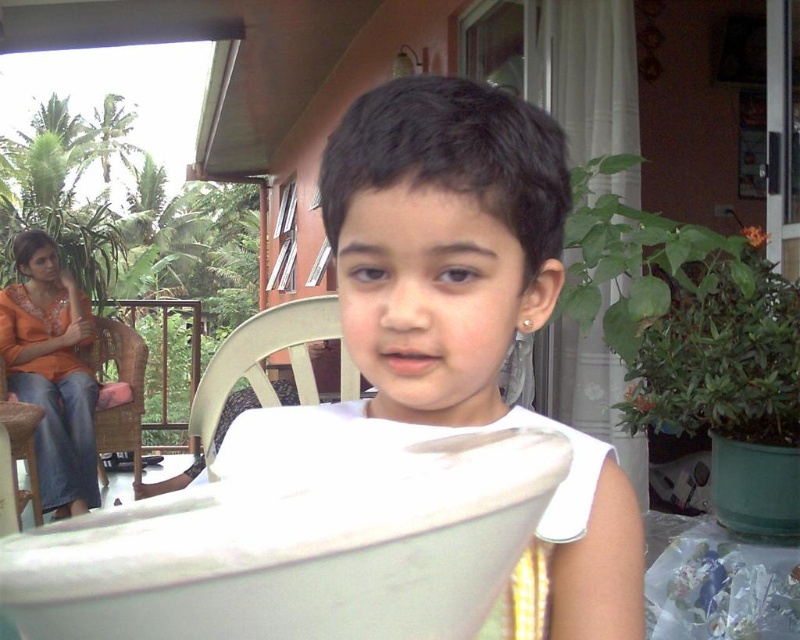
Question: Which object is farther from the camera taking this photo?

Choices:
 (A) wooden chair at center
 (B) white matte paper at center
 (C) transparent plastic bag at lower right
 (D) rattan chair at left

Answer: (D)

Question: Which point is farther to the camera?

Choices:
 (A) (713, 586)
 (B) (462, 180)
 (C) (345, 355)
 (D) (121, 362)

Answer: (D)

Question: Can you confirm if wooden chair at center is positioned to the right of rattan chair at left?

Choices:
 (A) no
 (B) yes

Answer: (B)

Question: Does wooden chair at center have a lesser width compared to rattan chair at left?

Choices:
 (A) yes
 (B) no

Answer: (B)

Question: Among these points, which one is nearest to the camera?

Choices:
 (A) (649, 612)
 (B) (392, 140)
 (C) (248, 340)
 (D) (96, 355)

Answer: (B)

Question: Can you confirm if white matte paper at center is positioned to the right of wooden chair at center?

Choices:
 (A) yes
 (B) no

Answer: (A)